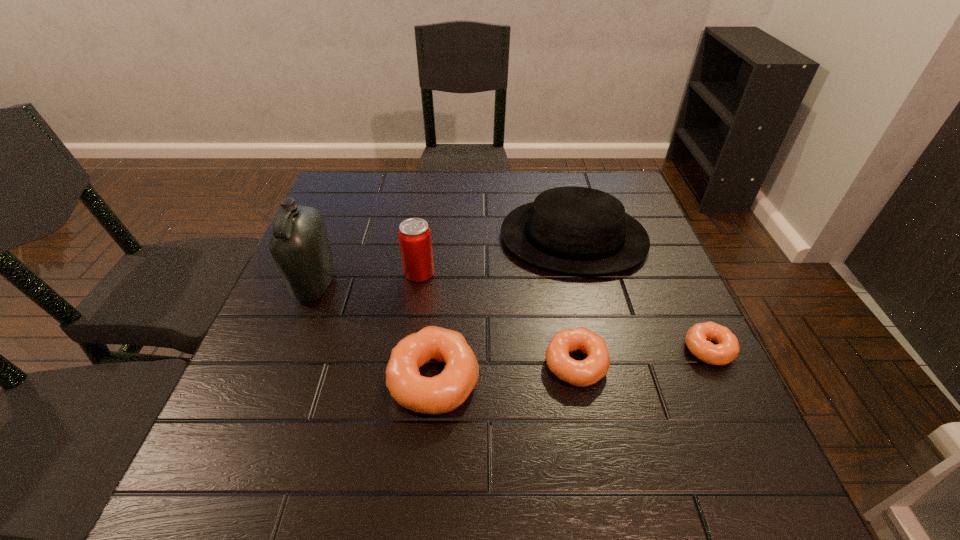
In order to click on fedora that is at the right edge in this screenshot , I will do `click(578, 230)`.

The height and width of the screenshot is (540, 960). I want to click on object located in the far right corner section of the desktop, so click(x=578, y=230).

Locate an element on the screen. free location at the far edge is located at coordinates (462, 192).

Find the location of a particular element. free space at the left edge is located at coordinates point(344,284).

In the image, there is a desktop. Where is `vacant space at the right edge`? vacant space at the right edge is located at coordinates (656, 250).

I want to click on vacant point at the far left corner, so click(x=374, y=177).

Identify the location of vacant area at the near left corner. Image resolution: width=960 pixels, height=540 pixels. (269, 408).

Where is `free space that is in between the second doughnut from right to left and the can`? This screenshot has height=540, width=960. free space that is in between the second doughnut from right to left and the can is located at coordinates (497, 318).

Identify the location of vacant space in between the rightmost doughnut and the fourth shortest object. This screenshot has height=540, width=960. (641, 293).

Identify the location of empty space that is in between the third shortest object and the tallest object. The height and width of the screenshot is (540, 960). (374, 332).